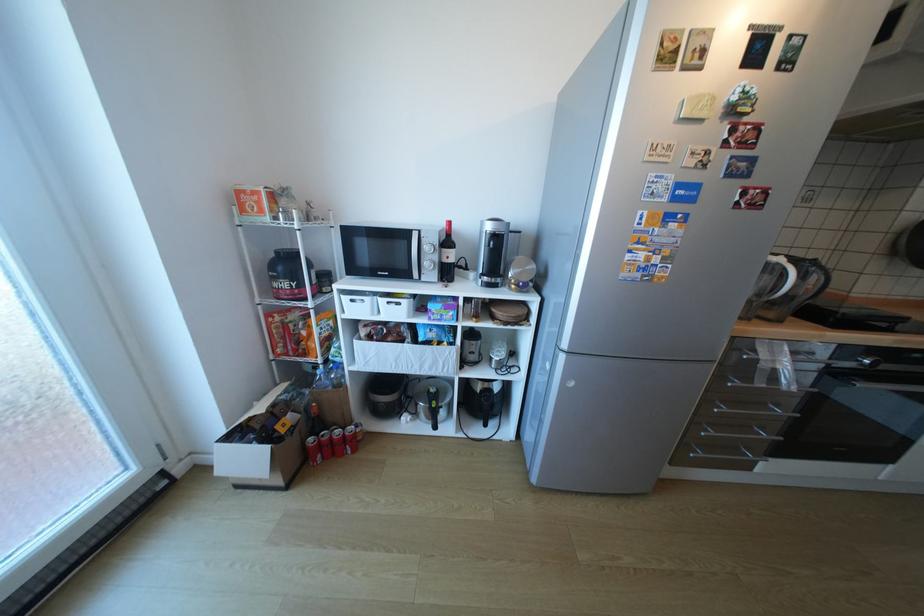
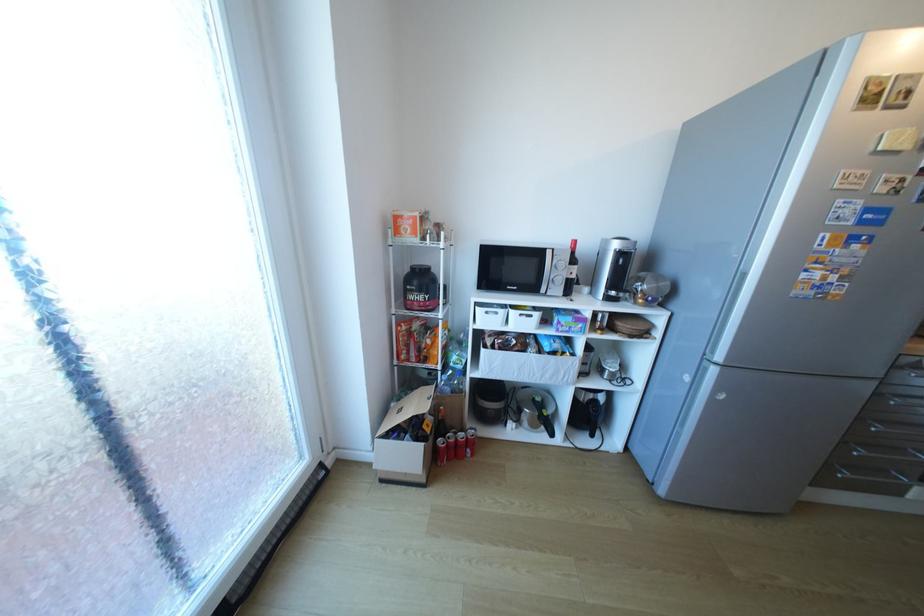
Find the pixel in the second image that matches (407,304) in the first image.

(540, 315)